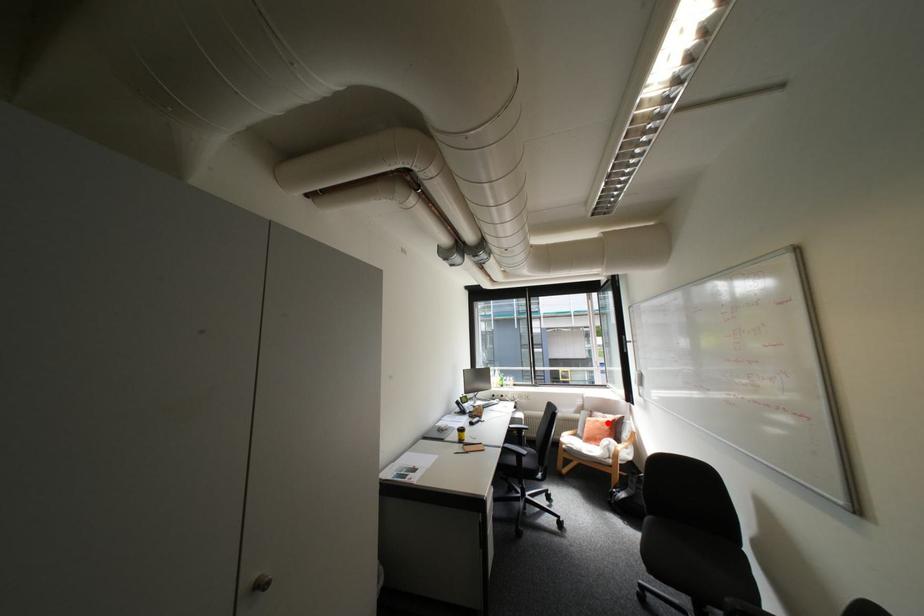
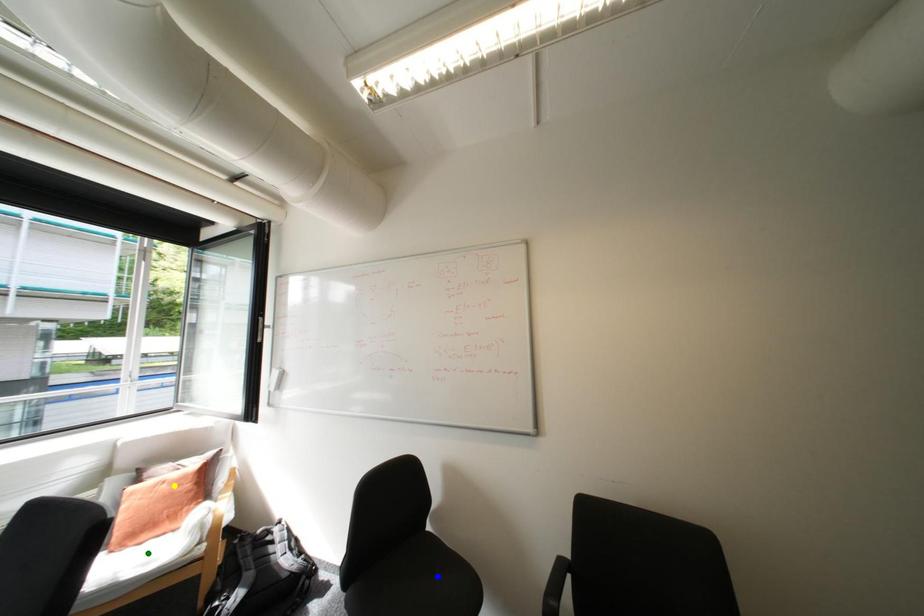
Question: I am providing you with two images of the same scene from different viewpoints. A red point is marked on the first image. You are given multiple points on the second image. Which point in image 2 is actually the same real-world point as the red point in image 1?

Choices:
 (A) blue point
 (B) yellow point
 (C) green point

Answer: (B)